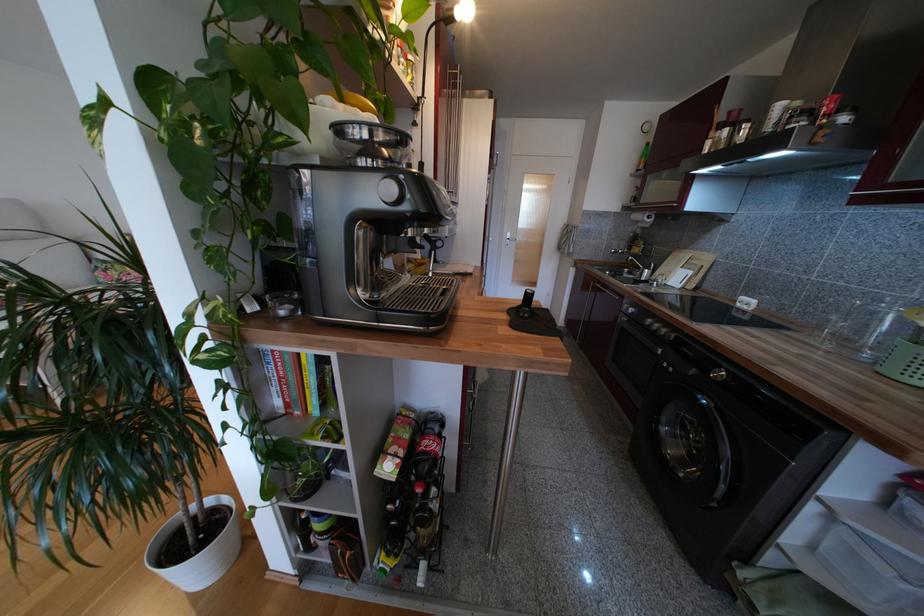
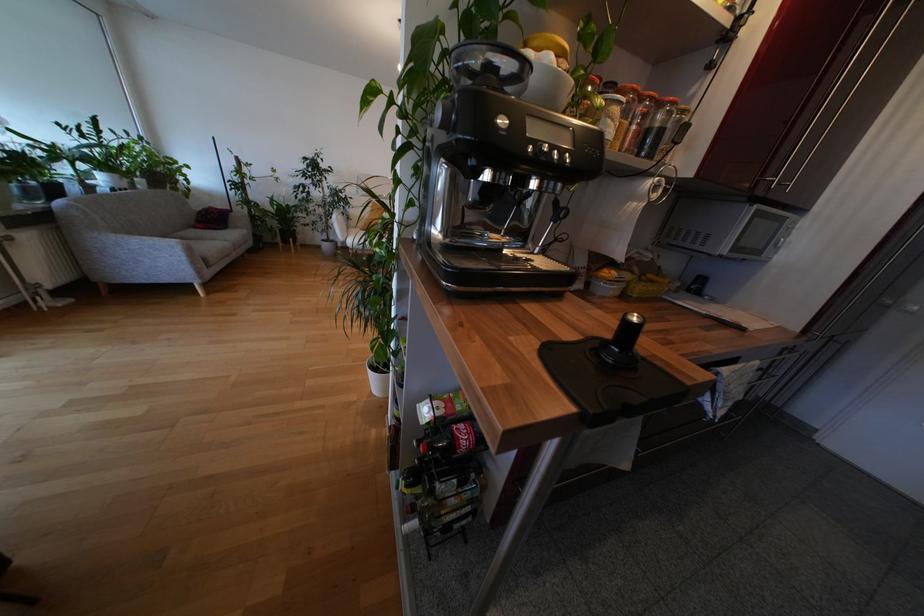
Question: How did the camera likely rotate?

Choices:
 (A) Left
 (B) Right
 (C) Up
 (D) Down

Answer: (A)